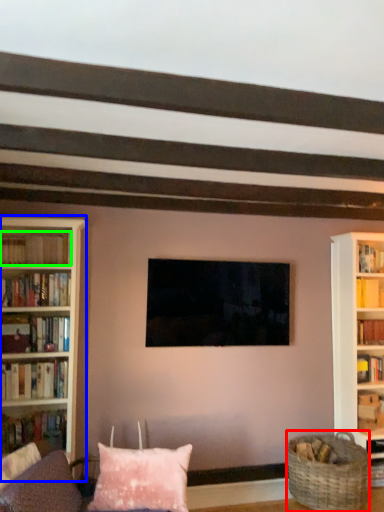
Question: Based on their relative distances, which object is farther from basket (highlighted by a red box)? Choose from bookcase (highlighted by a blue box) and book (highlighted by a green box).

Choices:
 (A) bookcase
 (B) book

Answer: (B)